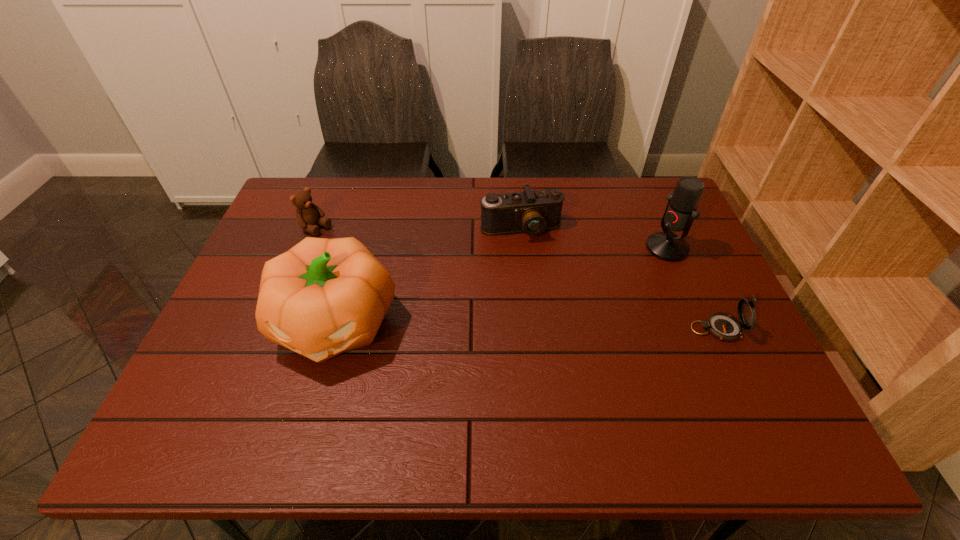
You are a GUI agent. You are given a task and a screenshot of the screen. Output one action in this format:
    pyautogui.click(x=<x>, y=<y>)
    Task: Click on the vacant region that satisfies the following two spatial constraints: 1. on the front side of the teddy bear; 2. on the face of the compass
    This screenshot has width=960, height=540.
    Given the screenshot: What is the action you would take?
    pyautogui.click(x=276, y=329)

This screenshot has width=960, height=540. I want to click on vacant space that satisfies the following two spatial constraints: 1. on the front side of the third object from right to left; 2. on the face of the compass, so click(x=531, y=329).